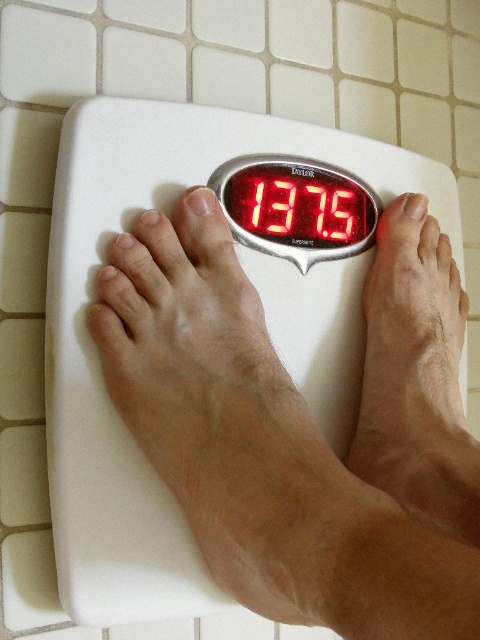
Question: Is white plastic scale at center behind red digital display at center?

Choices:
 (A) yes
 (B) no

Answer: (B)

Question: Among these objects, which one is farthest from the camera?

Choices:
 (A) red digital display at center
 (B) white plastic scale at center

Answer: (A)

Question: Does white plastic scale at center have a smaller size compared to red digital display at center?

Choices:
 (A) yes
 (B) no

Answer: (B)

Question: Which point is closer to the camera?

Choices:
 (A) (322, 216)
 (B) (127, 445)

Answer: (B)

Question: Is white plastic scale at center behind red digital display at center?

Choices:
 (A) no
 (B) yes

Answer: (A)